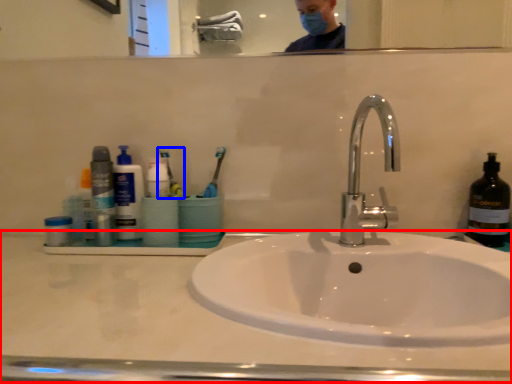
Question: Which of the following is the closest to the observer, counter top (highlighted by a red box) or toothbrush (highlighted by a blue box)?

Choices:
 (A) counter top
 (B) toothbrush

Answer: (A)